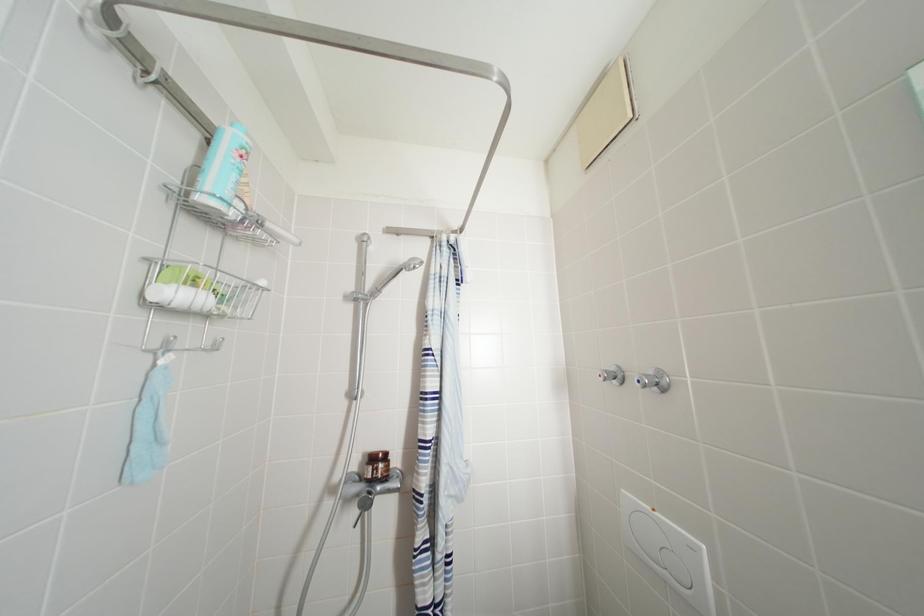
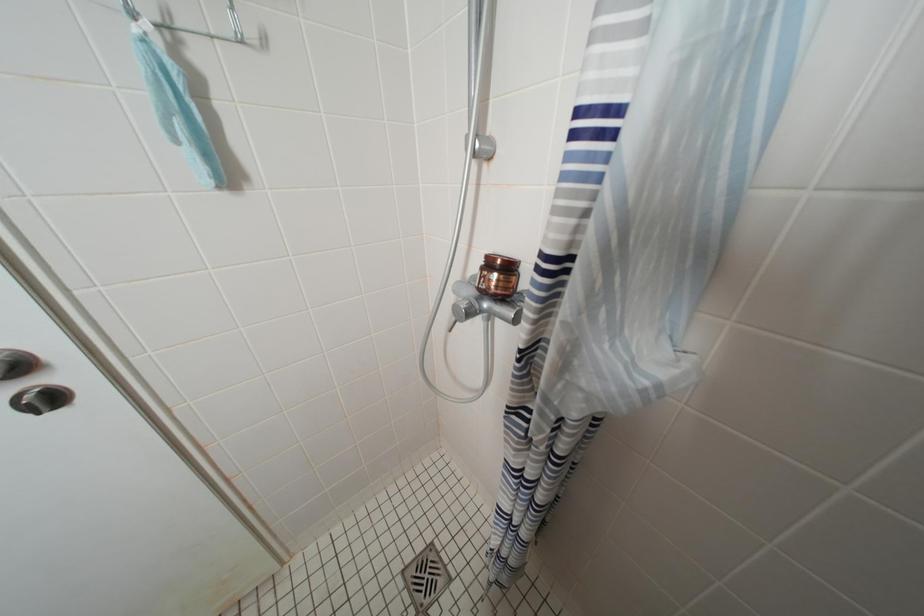
The first image is from the beginning of the video and the second image is from the end. How did the camera likely rotate when shooting the video?

The camera's rotation is toward left-down.